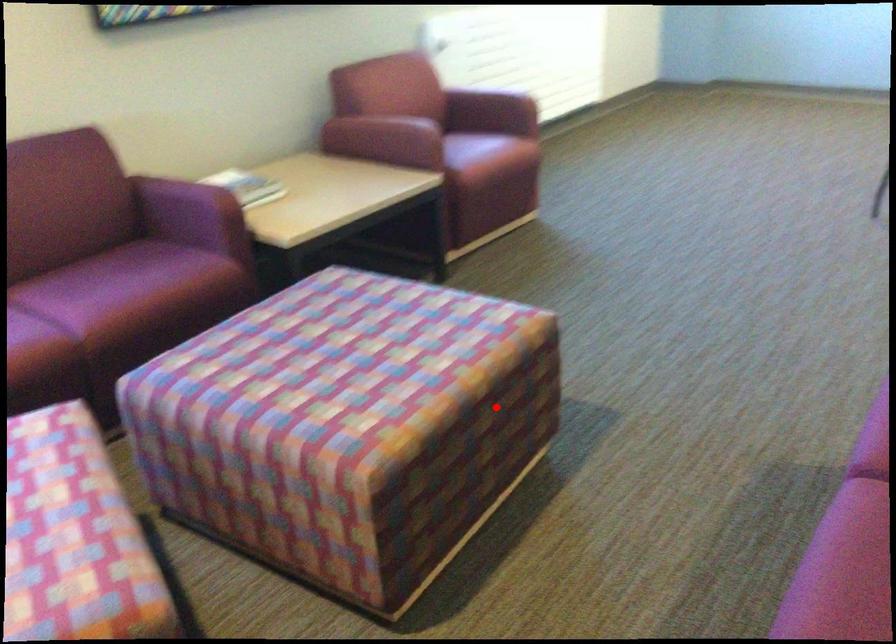
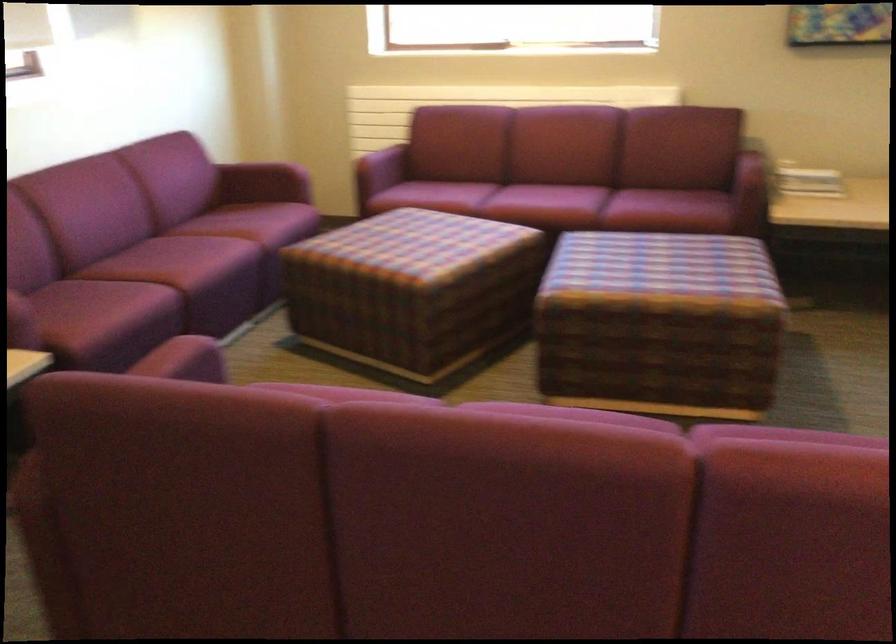
Locate, in the second image, the point that corresponds to the highlighted location in the first image.

(659, 324)